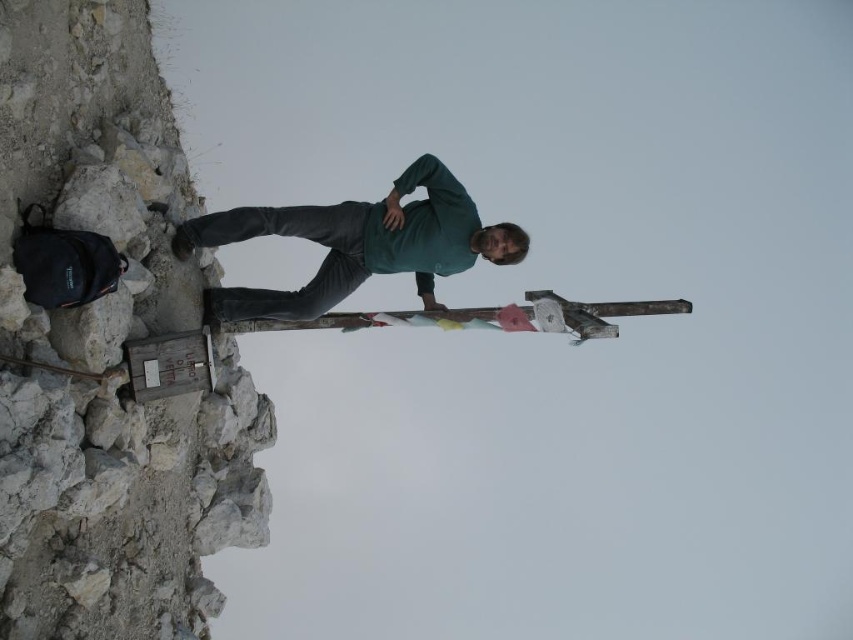
Question: Does rough stone cliff at left have a smaller size compared to green matte shirt at center?

Choices:
 (A) no
 (B) yes

Answer: (A)

Question: Which of the following is the closest to the observer?

Choices:
 (A) rough stone cliff at left
 (B) green matte shirt at center

Answer: (A)

Question: Considering the relative positions of rough stone cliff at left and green matte shirt at center in the image provided, where is rough stone cliff at left located with respect to green matte shirt at center?

Choices:
 (A) left
 (B) right

Answer: (A)

Question: Among these objects, which one is nearest to the camera?

Choices:
 (A) rough stone cliff at left
 (B) green matte shirt at center

Answer: (A)

Question: Which object appears closest to the camera in this image?

Choices:
 (A) rough stone cliff at left
 (B) green matte shirt at center

Answer: (A)

Question: Does rough stone cliff at left appear over green matte shirt at center?

Choices:
 (A) yes
 (B) no

Answer: (B)